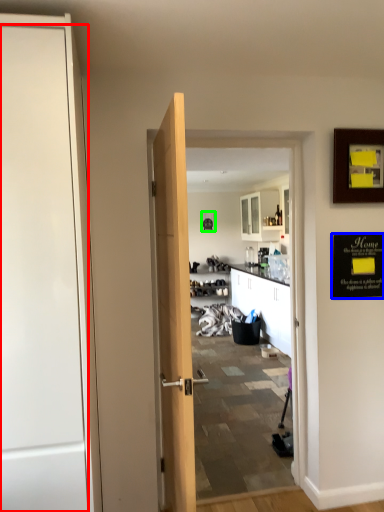
Question: Considering the real-world distances, which object is closest to door (highlighted by a red box)? bulletin board (highlighted by a blue box) or picture frame (highlighted by a green box).

Choices:
 (A) bulletin board
 (B) picture frame

Answer: (A)